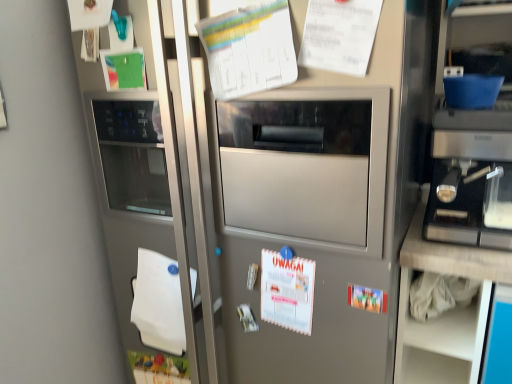
The image size is (512, 384). Describe the element at coordinates (470, 188) in the screenshot. I see `sleek metallic espresso machine at right` at that location.

Image resolution: width=512 pixels, height=384 pixels. What are the coordinates of `sleek metallic espresso machine at right` in the screenshot? It's located at (470, 188).

This screenshot has width=512, height=384. Identify the location of satin silver refrigerator at center. (310, 200).

Find the location of a particular element. The width and height of the screenshot is (512, 384). sleek metallic espresso machine at right is located at coordinates (470, 188).

Can you confirm if satin silver refrigerator at center is taller than white paper at upper center, the second poster positioned from the top?

Yes.

Can you confirm if satin silver refrigerator at center is bigger than white paper at upper center, the second poster positioned from the top?

Yes, satin silver refrigerator at center is bigger than white paper at upper center, the second poster positioned from the top.

From the image's perspective, is satin silver refrigerator at center located above or below white paper at upper center, positioned as the 3th poster in bottom-to-top order?

satin silver refrigerator at center is situated lower than white paper at upper center, positioned as the 3th poster in bottom-to-top order, in the image.

You are a GUI agent. You are given a task and a screenshot of the screen. Output one action in this format:
    pyautogui.click(x=<x>, y=<y>)
    Task: Click on the appliance above the matte plastic poster at center, arranged as the first poster when ordered from the bottom (from a real-world perspective)
    
    Given the screenshot: What is the action you would take?
    pyautogui.click(x=470, y=188)

Considering the sizes of objects matte plastic poster at center, marked as the fourth poster in a top-to-bottom arrangement, and sleek metallic espresso machine at right in the image provided, who is smaller, matte plastic poster at center, marked as the fourth poster in a top-to-bottom arrangement, or sleek metallic espresso machine at right?

matte plastic poster at center, marked as the fourth poster in a top-to-bottom arrangement.

How many degrees apart are the facing directions of matte plastic poster at center, marked as the fourth poster in a top-to-bottom arrangement, and sleek metallic espresso machine at right?

The facing directions of matte plastic poster at center, marked as the fourth poster in a top-to-bottom arrangement, and sleek metallic espresso machine at right are 1.03 degrees apart.

Between white paper at upper center, the second poster positioned from the top, and sleek metallic espresso machine at right, which one has smaller width?

Thinner between the two is white paper at upper center, the second poster positioned from the top.

Is white paper at upper center, the second poster positioned from the top, facing away from sleek metallic espresso machine at right?

No, white paper at upper center, the second poster positioned from the top, is not facing away from sleek metallic espresso machine at right.

Is white paper at upper center, the second poster positioned from the top, beside sleek metallic espresso machine at right?

No, white paper at upper center, the second poster positioned from the top, is not making contact with sleek metallic espresso machine at right.

Does point (233, 53) appear closer or farther from the camera than point (437, 148)?

Point (233, 53) is closer to the camera than point (437, 148).

Consider the image. In terms of height, does white paper at upper center, which is the fourth poster in bottom-to-top order, look taller or shorter compared to matte plastic poster at center, marked as the fourth poster in a top-to-bottom arrangement?

In the image, white paper at upper center, which is the fourth poster in bottom-to-top order, appears to be taller than matte plastic poster at center, marked as the fourth poster in a top-to-bottom arrangement.

Considering the relative sizes of white paper at upper center, which is the fourth poster in bottom-to-top order, and matte plastic poster at center, marked as the fourth poster in a top-to-bottom arrangement, in the image provided, is white paper at upper center, which is the fourth poster in bottom-to-top order, smaller than matte plastic poster at center, marked as the fourth poster in a top-to-bottom arrangement,?

No, white paper at upper center, which is the fourth poster in bottom-to-top order, is not smaller than matte plastic poster at center, marked as the fourth poster in a top-to-bottom arrangement.

Is white paper at upper center, which appears as the first poster when viewed from the top, beside matte plastic poster at center, marked as the fourth poster in a top-to-bottom arrangement?

white paper at upper center, which appears as the first poster when viewed from the top, is not next to matte plastic poster at center, marked as the fourth poster in a top-to-bottom arrangement, and they're not touching.

From the image's perspective, who appears lower, white paper at upper center, which is the fourth poster in bottom-to-top order, or matte plastic poster at center, marked as the fourth poster in a top-to-bottom arrangement?

From the image's view, matte plastic poster at center, marked as the fourth poster in a top-to-bottom arrangement, is below.

Is matte plastic poster at center, arranged as the first poster when ordered from the bottom, wider or thinner than white paper at upper center, the second poster positioned from the top?

Clearly, matte plastic poster at center, arranged as the first poster when ordered from the bottom, has less width compared to white paper at upper center, the second poster positioned from the top.

Choose the correct answer: Is matte plastic poster at center, arranged as the first poster when ordered from the bottom, inside white paper at upper center, the second poster positioned from the top, or outside it?

matte plastic poster at center, arranged as the first poster when ordered from the bottom, exists outside the volume of white paper at upper center, the second poster positioned from the top.

Considering the positions of objects matte plastic poster at center, marked as the fourth poster in a top-to-bottom arrangement, and white paper at upper center, the second poster positioned from the top, in the image provided, who is behind, matte plastic poster at center, marked as the fourth poster in a top-to-bottom arrangement, or white paper at upper center, the second poster positioned from the top,?

matte plastic poster at center, marked as the fourth poster in a top-to-bottom arrangement, is more distant.

From the image's perspective, who appears lower, white paper calendar at center, the 3th poster positioned from the top, or sleek metallic espresso machine at right?

white paper calendar at center, the 3th poster positioned from the top, is shown below in the image.

Is the surface of white paper calendar at center, which ranks as the second poster in bottom-to-top order, in direct contact with sleek metallic espresso machine at right?

No, white paper calendar at center, which ranks as the second poster in bottom-to-top order, is not next to sleek metallic espresso machine at right.

Is white paper calendar at center, which ranks as the second poster in bottom-to-top order, inside the boundaries of sleek metallic espresso machine at right, or outside?

white paper calendar at center, which ranks as the second poster in bottom-to-top order, exists outside the volume of sleek metallic espresso machine at right.

Which is behind, point (281, 297) or point (446, 214)?

Point (281, 297)

From a real-world perspective, is matte plastic poster at center, marked as the fourth poster in a top-to-bottom arrangement, located beneath white paper at lower left?

No, from a real-world perspective, matte plastic poster at center, marked as the fourth poster in a top-to-bottom arrangement, is not beneath white paper at lower left.

Which is behind, matte plastic poster at center, arranged as the first poster when ordered from the bottom, or white paper at lower left?

white paper at lower left is further from the camera.

Considering the relative positions of matte plastic poster at center, marked as the fourth poster in a top-to-bottom arrangement, and white paper at lower left in the image provided, is matte plastic poster at center, marked as the fourth poster in a top-to-bottom arrangement, to the left or to the right of white paper at lower left?

Based on their positions, matte plastic poster at center, marked as the fourth poster in a top-to-bottom arrangement, is located to the right of white paper at lower left.

How different are the orientations of matte plastic poster at center, marked as the fourth poster in a top-to-bottom arrangement, and white paper at lower left in degrees?

2.26 degrees.

Locate an element on the screen. The height and width of the screenshot is (384, 512). fridge lying in front of the white paper at upper center, the second poster positioned from the top is located at coordinates (310, 200).

From the image's perspective, which poster is the 2nd one below the sleek metallic espresso machine at right? Please provide its 2D coordinates.

[(367, 298)]

Based on their spatial positions, is white paper at upper center, which appears as the first poster when viewed from the top, or sleek metallic espresso machine at right further from white paper calendar at center, the 3th poster positioned from the top?

white paper at upper center, which appears as the first poster when viewed from the top.

When comparing their distances from white paper at upper center, the second poster positioned from the top, does satin silver refrigerator at center or white paper at upper center, which is the fourth poster in bottom-to-top order, seem further?

satin silver refrigerator at center.

Considering their positions, is sleek metallic espresso machine at right positioned further to white paper at upper center, which is the fourth poster in bottom-to-top order, than white paper at upper center, positioned as the 3th poster in bottom-to-top order?

sleek metallic espresso machine at right is further to white paper at upper center, which is the fourth poster in bottom-to-top order.

Based on their spatial positions, is white paper at upper center, which appears as the first poster when viewed from the top, or white paper at upper center, the second poster positioned from the top, closer to white paper calendar at center, the 3th poster positioned from the top?

white paper at upper center, the second poster positioned from the top, is positioned closer to the anchor white paper calendar at center, the 3th poster positioned from the top.

Considering their positions, is satin silver refrigerator at center positioned closer to matte plastic poster at center, marked as the fourth poster in a top-to-bottom arrangement, than white paper at upper center, positioned as the 3th poster in bottom-to-top order?

Based on the image, satin silver refrigerator at center appears to be nearer to matte plastic poster at center, marked as the fourth poster in a top-to-bottom arrangement.

Looking at this image, based on their spatial positions, is matte plastic poster at center, marked as the fourth poster in a top-to-bottom arrangement, or white paper calendar at center, which ranks as the second poster in bottom-to-top order, closer to white paper at upper center, which appears as the first poster when viewed from the top?

Based on the image, white paper calendar at center, which ranks as the second poster in bottom-to-top order, appears to be nearer to white paper at upper center, which appears as the first poster when viewed from the top.

Estimate the real-world distances between objects in this image. Which object is closer to white paper calendar at center, which ranks as the second poster in bottom-to-top order, satin silver refrigerator at center or white paper at upper center, positioned as the 3th poster in bottom-to-top order?

Based on the image, satin silver refrigerator at center appears to be nearer to white paper calendar at center, which ranks as the second poster in bottom-to-top order.

Looking at the image, which one is located further to satin silver refrigerator at center, white paper at upper center, positioned as the 3th poster in bottom-to-top order, or white paper calendar at center, which ranks as the second poster in bottom-to-top order?

white paper at upper center, positioned as the 3th poster in bottom-to-top order.

I want to click on fridge between white paper at upper center, the second poster positioned from the top, and sleek metallic espresso machine at right from left to right, so click(x=310, y=200).

This screenshot has height=384, width=512. Identify the location of fridge between white paper at upper center, which is the fourth poster in bottom-to-top order, and matte plastic poster at center, marked as the fourth poster in a top-to-bottom arrangement, vertically. (310, 200).

Identify the location of poster that lies between white paper at upper center, positioned as the 3th poster in bottom-to-top order, and matte plastic poster at center, marked as the fourth poster in a top-to-bottom arrangement, from top to bottom. (287, 291).

This screenshot has width=512, height=384. I want to click on poster that lies between white paper at upper center, which is the fourth poster in bottom-to-top order, and satin silver refrigerator at center from top to bottom, so click(x=249, y=49).